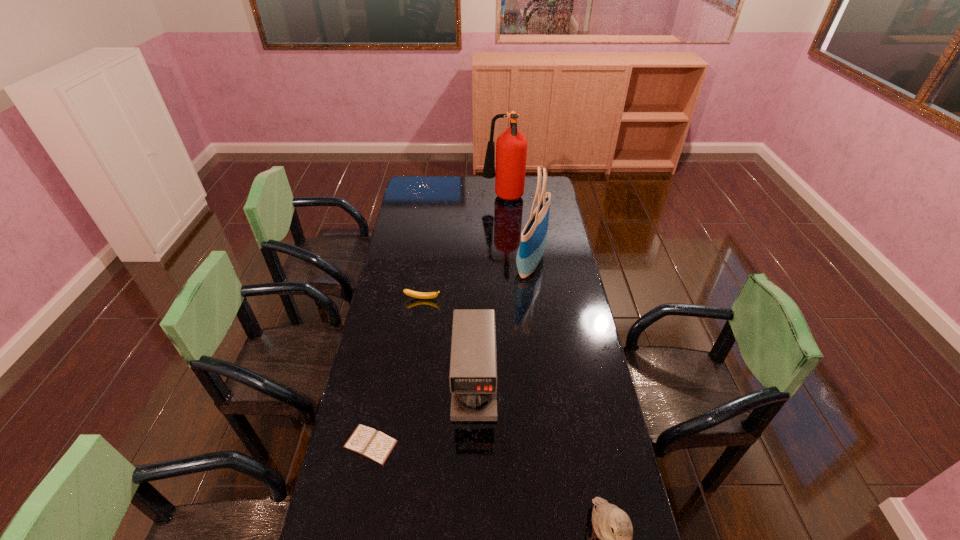
Locate an element on the screen. free space at the far left corner of the desktop is located at coordinates (434, 187).

Locate an element on the screen. free area in between the fourth farthest object and the tote bag is located at coordinates (503, 325).

What are the coordinates of `vacant space in between the second shortest object and the diary` in the screenshot? It's located at (396, 372).

Find the location of a particular element. This screenshot has height=540, width=960. unoccupied position between the farthest object and the shortest object is located at coordinates (437, 322).

Where is `free spot between the shortest object and the fifth nearest object`? Image resolution: width=960 pixels, height=540 pixels. free spot between the shortest object and the fifth nearest object is located at coordinates (451, 354).

You are a GUI agent. You are given a task and a screenshot of the screen. Output one action in this format:
    pyautogui.click(x=<x>, y=<y>)
    Task: Click on the vacant point located between the third farthest object and the fifth nearest object
    The height and width of the screenshot is (540, 960).
    Given the screenshot: What is the action you would take?
    pyautogui.click(x=477, y=281)

Identify the location of empty space between the third nearest object and the tote bag. (503, 325).

What are the coordinates of `free area in between the fifth tallest object and the second nearest object` in the screenshot? It's located at (396, 372).

Identify the location of object identified as the closest to the fifth farthest object. This screenshot has width=960, height=540. (473, 363).

Where is `object identified as the second closest to the second nearest object`? object identified as the second closest to the second nearest object is located at coordinates [613, 527].